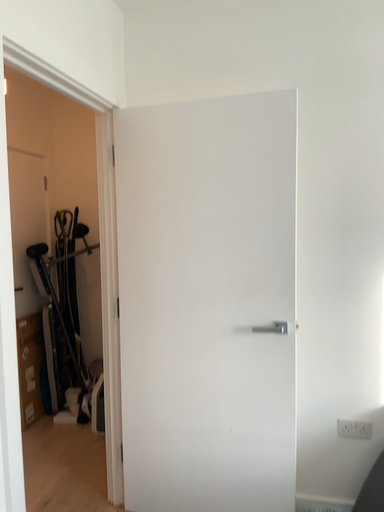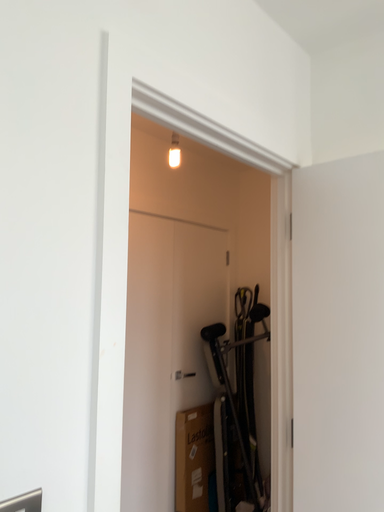
Question: How did the camera likely rotate when shooting the video?

Choices:
 (A) rotated upward
 (B) rotated downward

Answer: (A)